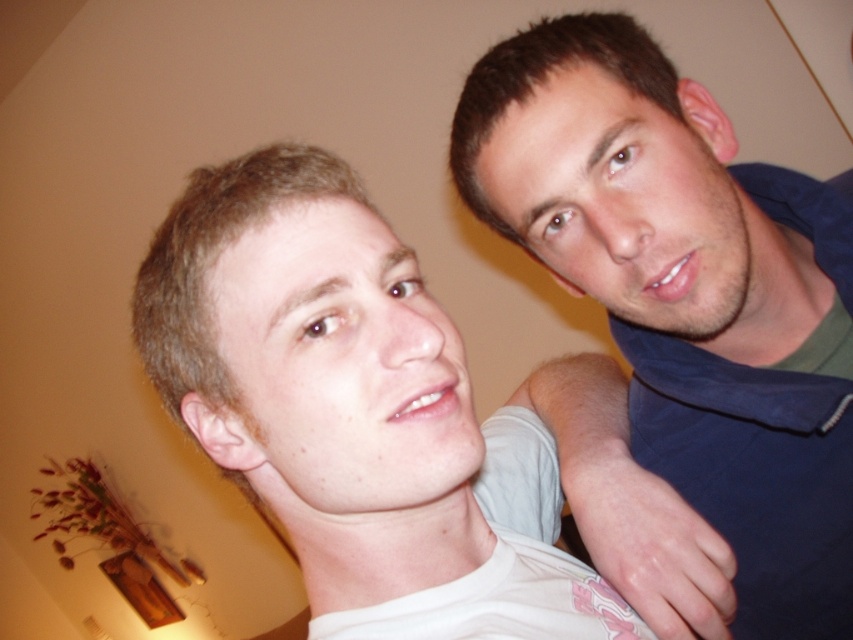
Question: Is blue cotton shirt at upper right above white matte shirt at center?

Choices:
 (A) yes
 (B) no

Answer: (A)

Question: Among these objects, which one is nearest to the camera?

Choices:
 (A) white matte shirt at center
 (B) blue cotton shirt at upper right

Answer: (A)

Question: Does blue cotton shirt at upper right come behind white matte shirt at center?

Choices:
 (A) yes
 (B) no

Answer: (A)

Question: Is blue cotton shirt at upper right behind white matte shirt at center?

Choices:
 (A) yes
 (B) no

Answer: (A)